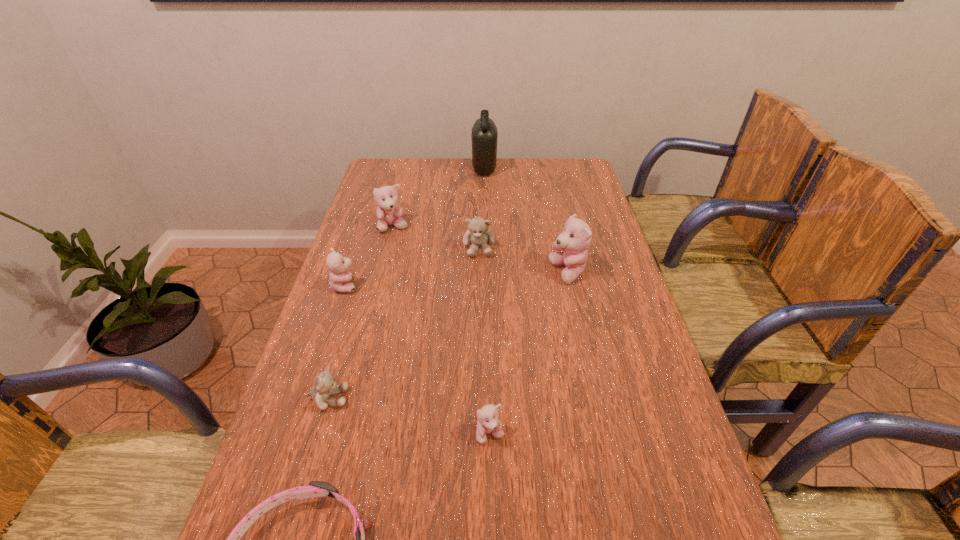
Image resolution: width=960 pixels, height=540 pixels. I want to click on bottle, so click(484, 134).

Find the location of a particular element. the tallest object is located at coordinates (484, 134).

The height and width of the screenshot is (540, 960). Identify the location of the seventh shortest object. (575, 239).

Locate an element on the screen. The image size is (960, 540). the rightmost object is located at coordinates click(x=575, y=239).

Identify the location of the farthest teddy bear. point(389,213).

The height and width of the screenshot is (540, 960). I want to click on the second farthest object, so click(x=389, y=213).

Identify the location of the leftmost pink teddy bear. (339, 277).

In order to click on the fifth nearest teddy bear in this screenshot , I will do `click(478, 234)`.

Identify the location of the third farthest object. This screenshot has height=540, width=960. coord(478,234).

At what (x,y) coordinates should I click in order to perform the action: click on the smallest pink teddy bear. Please return your answer as a coordinate pair (x, y). The height and width of the screenshot is (540, 960). Looking at the image, I should click on (488, 423).